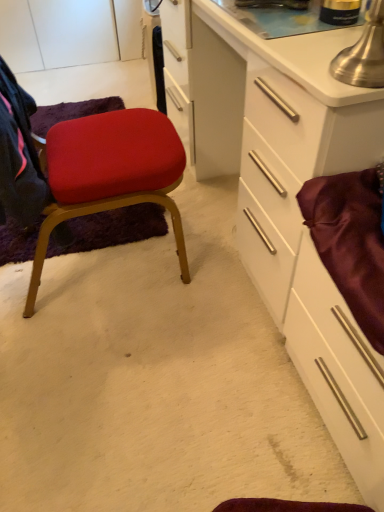
Question: From the image's perspective, does satin burgundy drawer at right appear lower than matte fabric chair at left?

Choices:
 (A) yes
 (B) no

Answer: (A)

Question: Considering the relative sizes of satin burgundy drawer at right and matte fabric chair at left in the image provided, is satin burgundy drawer at right bigger than matte fabric chair at left?

Choices:
 (A) no
 (B) yes

Answer: (A)

Question: Does satin burgundy drawer at right come behind matte fabric chair at left?

Choices:
 (A) yes
 (B) no

Answer: (B)

Question: Can you confirm if satin burgundy drawer at right is thinner than matte fabric chair at left?

Choices:
 (A) yes
 (B) no

Answer: (A)

Question: From a real-world perspective, does satin burgundy drawer at right sit lower than matte fabric chair at left?

Choices:
 (A) no
 (B) yes

Answer: (B)

Question: From a real-world perspective, is satin burgundy drawer at right positioned above or below white glossy cabinet at center?

Choices:
 (A) above
 (B) below

Answer: (B)

Question: Considering their positions, is satin burgundy drawer at right located in front of or behind white glossy cabinet at center?

Choices:
 (A) behind
 (B) front

Answer: (B)

Question: Considering the positions of point (x=322, y=344) and point (x=322, y=117), is point (x=322, y=344) closer or farther from the camera than point (x=322, y=117)?

Choices:
 (A) farther
 (B) closer

Answer: (A)

Question: Looking at the image, does satin burgundy drawer at right seem bigger or smaller compared to white glossy cabinet at center?

Choices:
 (A) small
 (B) big

Answer: (A)

Question: Is point (139, 114) closer or farther from the camera than point (350, 452)?

Choices:
 (A) closer
 (B) farther

Answer: (B)

Question: Considering the relative positions of matte fabric chair at left and satin burgundy drawer at right in the image provided, is matte fabric chair at left to the left or to the right of satin burgundy drawer at right?

Choices:
 (A) left
 (B) right

Answer: (A)

Question: Looking at the image, does matte fabric chair at left seem bigger or smaller compared to satin burgundy drawer at right?

Choices:
 (A) big
 (B) small

Answer: (A)

Question: In the image, is matte fabric chair at left positioned in front of or behind satin burgundy drawer at right?

Choices:
 (A) front
 (B) behind

Answer: (B)

Question: From their relative heights in the image, would you say white glossy cabinet at center is taller or shorter than satin burgundy drawer at right?

Choices:
 (A) short
 (B) tall

Answer: (B)

Question: Would you say white glossy cabinet at center is to the left or to the right of satin burgundy drawer at right in the picture?

Choices:
 (A) left
 (B) right

Answer: (A)